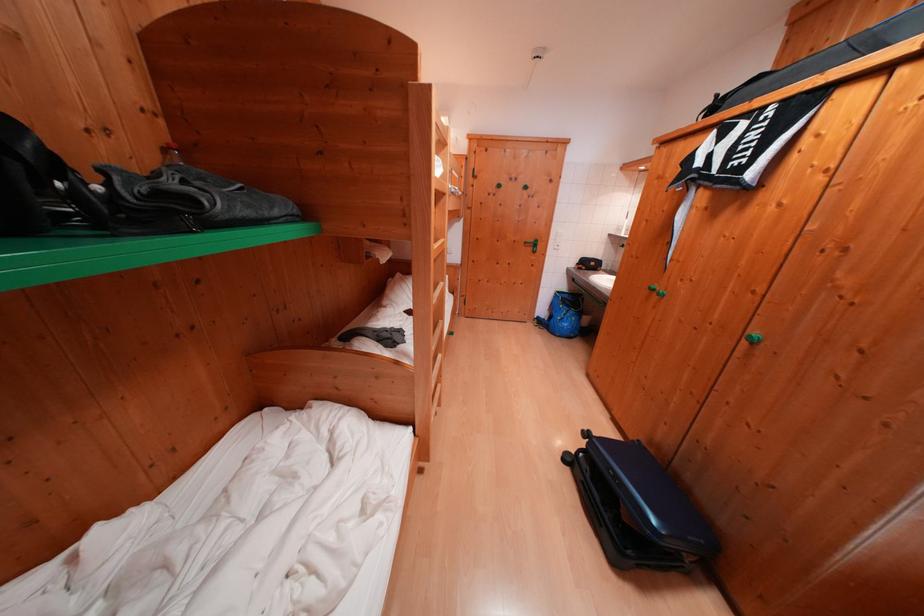
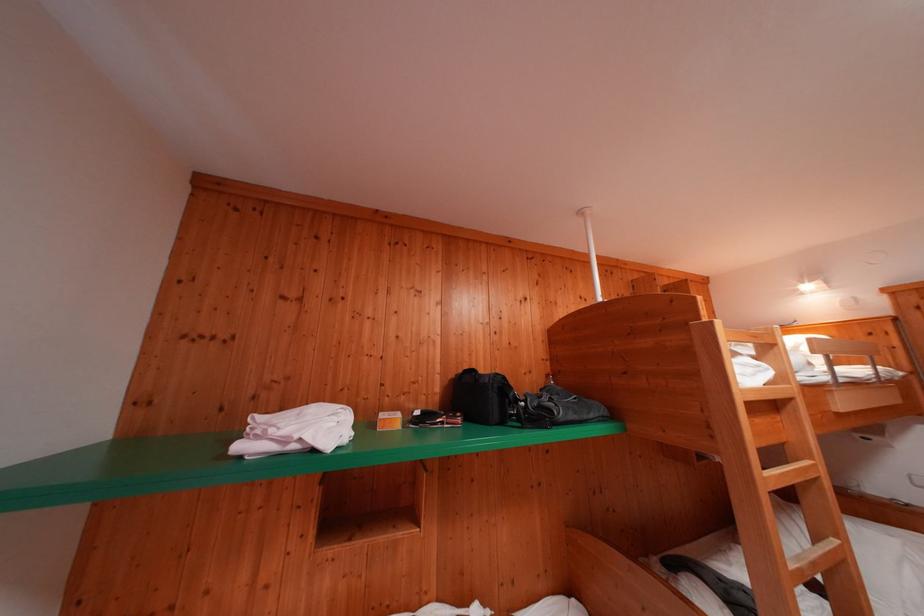
The first image is from the beginning of the video and the second image is from the end. How did the camera likely rotate when shooting the video?

The camera rotated toward left-up.